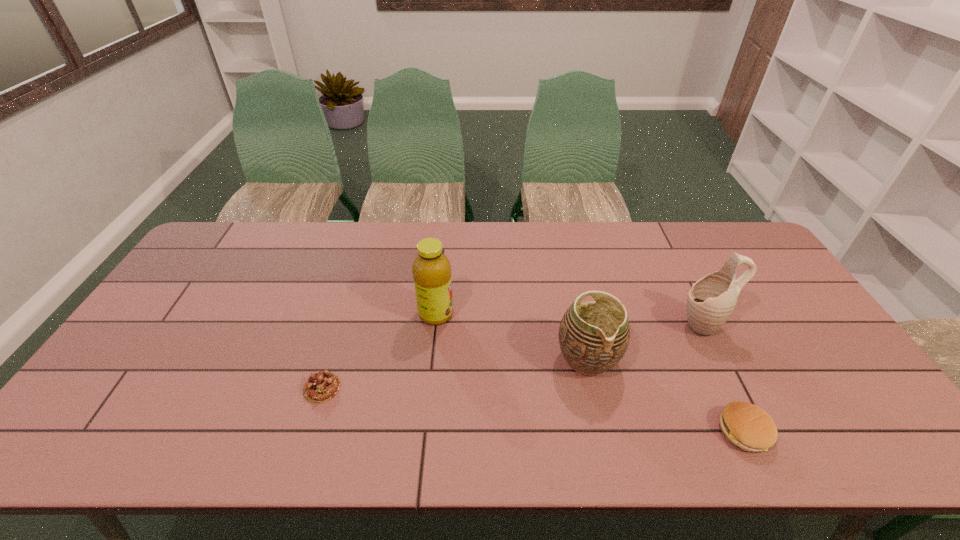
In the image, there is a desktop. Where is `vacant space at the far right corner`? vacant space at the far right corner is located at coordinates (727, 230).

The image size is (960, 540). Identify the location of free point between the third tallest object and the pitcher. (645, 342).

This screenshot has height=540, width=960. Identify the location of free space between the second object from left to right and the pottery. (512, 336).

Identify the location of free spot between the second shortest object and the third object from left to right. The height and width of the screenshot is (540, 960). (665, 395).

Find the location of a particular element. The height and width of the screenshot is (540, 960). vacant area that lies between the second shortest object and the third object from left to right is located at coordinates (665, 395).

At what (x,y) coordinates should I click in order to perform the action: click on vacant area that lies between the pottery and the fourth object from right to left. Please return your answer as a coordinate pair (x, y). Looking at the image, I should click on (512, 336).

The width and height of the screenshot is (960, 540). Find the location of `vacant area that lies between the fruit juice and the third shortest object`. vacant area that lies between the fruit juice and the third shortest object is located at coordinates (512, 336).

You are a GUI agent. You are given a task and a screenshot of the screen. Output one action in this format:
    pyautogui.click(x=<x>, y=<y>)
    Task: Click on the vacant region between the fourth object from right to left and the chocolate cake
    This screenshot has height=540, width=960.
    Given the screenshot: What is the action you would take?
    pyautogui.click(x=379, y=351)

Where is `unoccupied position between the third shortest object and the fourth object from right to left`? This screenshot has width=960, height=540. unoccupied position between the third shortest object and the fourth object from right to left is located at coordinates (512, 336).

Select which object is the fourth closest to the pitcher. Please provide its 2D coordinates. Your answer should be formatted as a tuple, i.e. [(x, y)], where the tuple contains the x and y coordinates of a point satisfying the conditions above.

[(322, 386)]